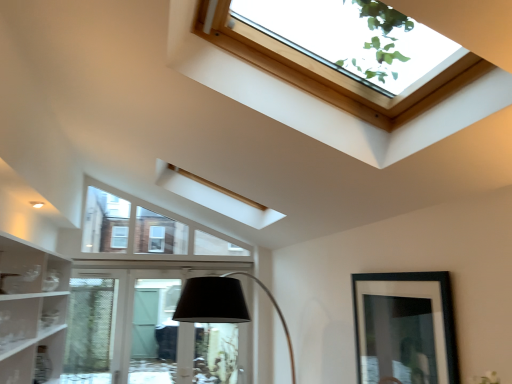
Question: Considering the positions of black matte picture frame at lower right and wooden frame skylight at upper center in the image, is black matte picture frame at lower right bigger or smaller than wooden frame skylight at upper center?

Choices:
 (A) small
 (B) big

Answer: (A)

Question: From the image's perspective, is black matte picture frame at lower right positioned above or below wooden frame skylight at upper center?

Choices:
 (A) below
 (B) above

Answer: (A)

Question: Based on their relative distances, which object is nearer to the wooden frame skylight at upper center?

Choices:
 (A) black matte picture frame at lower right
 (B) clear glass door at lower center

Answer: (A)

Question: Considering the real-world distances, which object is farthest from the clear glass door at lower center?

Choices:
 (A) wooden frame skylight at upper center
 (B) black matte picture frame at lower right

Answer: (A)